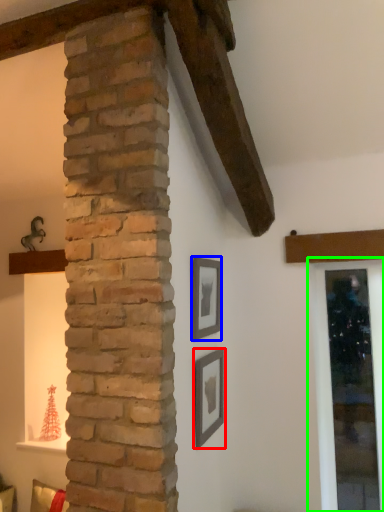
Question: Estimate the real-world distances between objects in this image. Which object is closer to picture frame (highlighted by a red box), picture frame (highlighted by a blue box) or window frame (highlighted by a green box)?

Choices:
 (A) picture frame
 (B) window frame

Answer: (A)